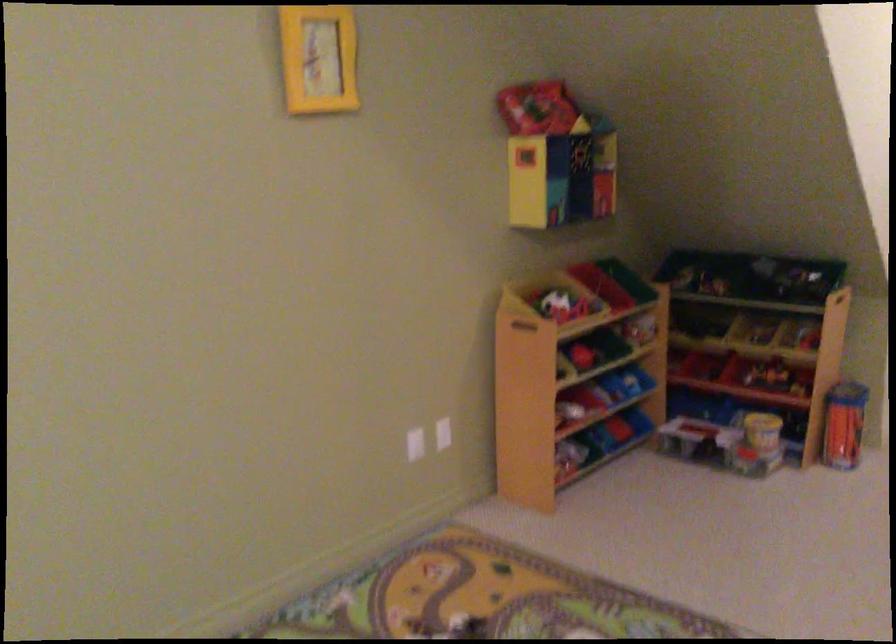
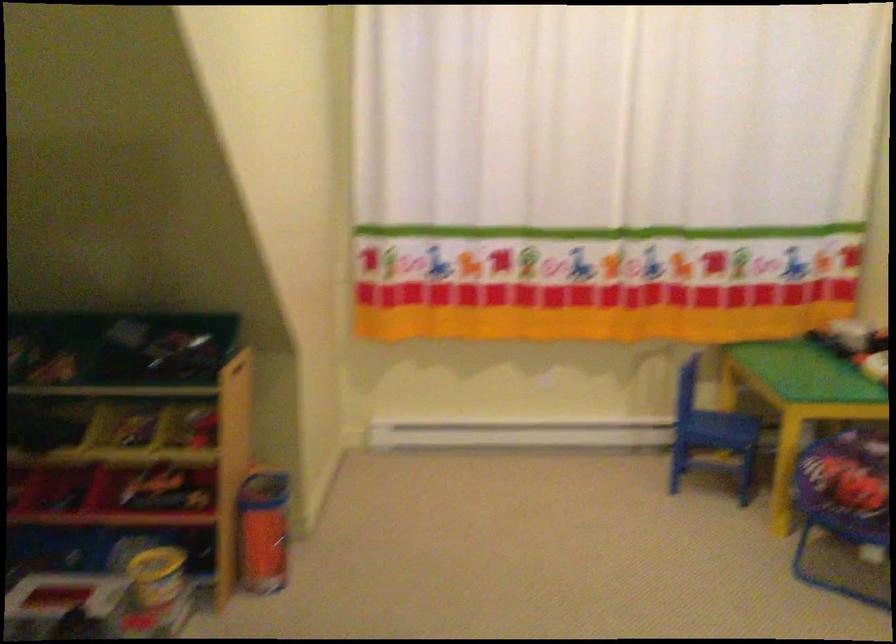
Question: The camera is either moving clockwise (left) or counter-clockwise (right) around the object. The first image is from the beginning of the video and the second image is from the end. Is the camera moving left or right when shooting the video?

Choices:
 (A) Left
 (B) Right

Answer: (A)